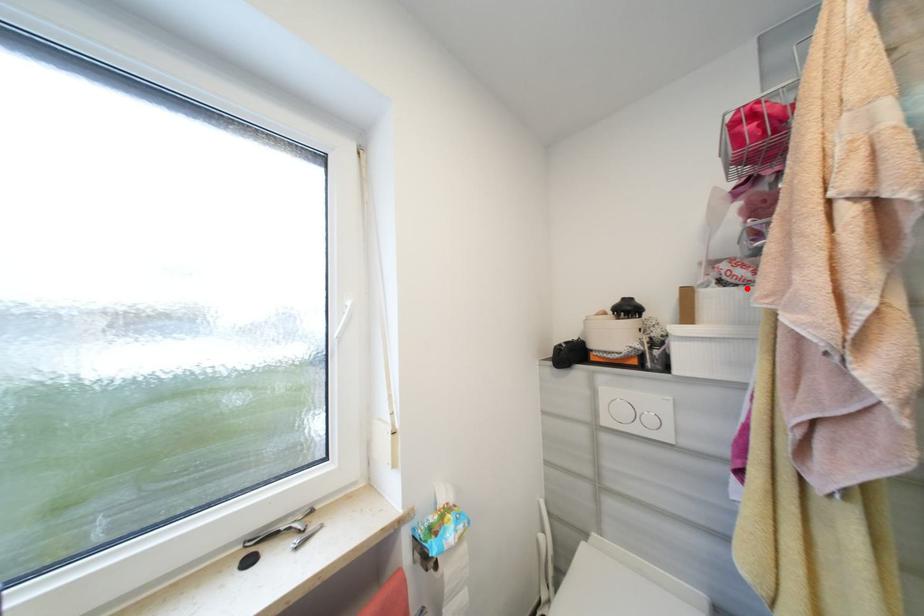
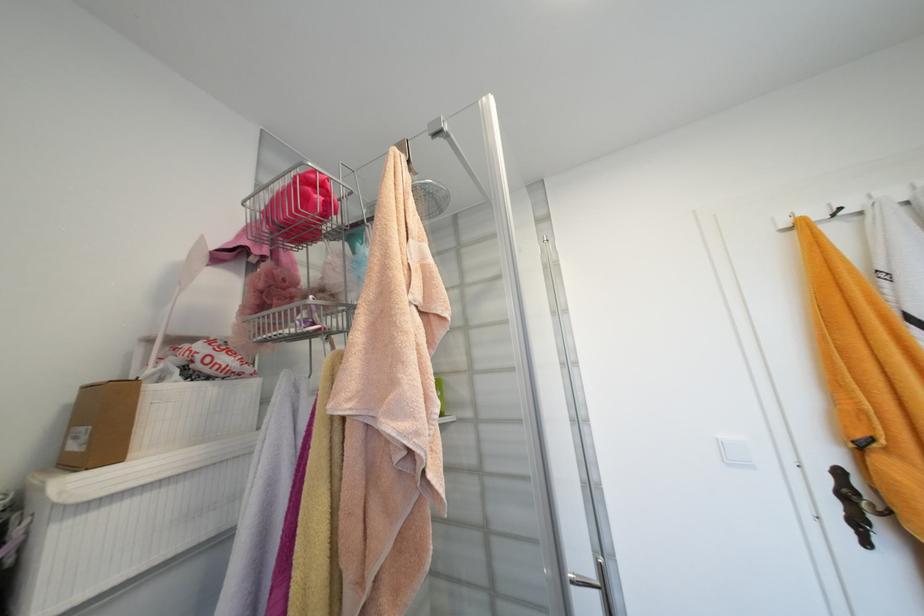
The point at the highlighted location is marked in the first image. Where is the corresponding point in the second image?

(224, 383)